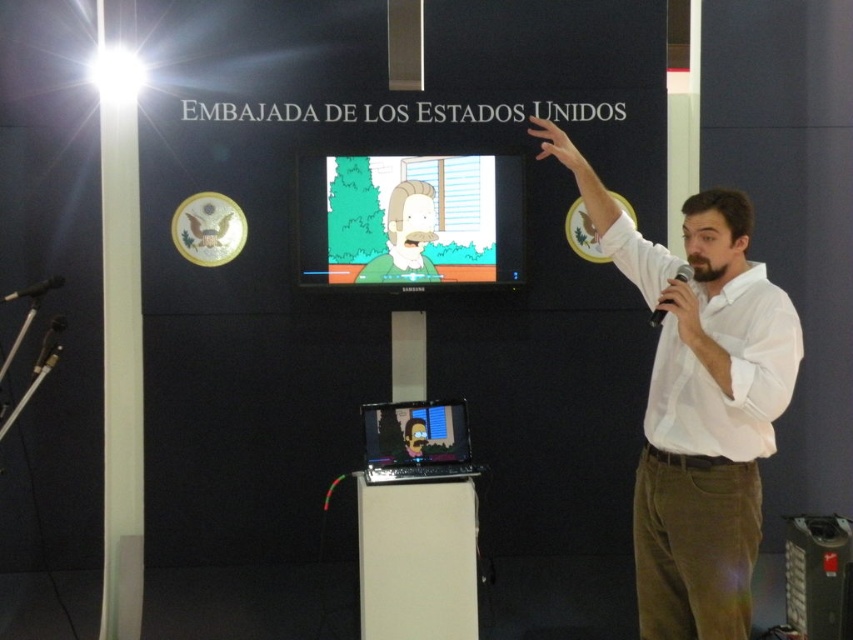
You are standing in front of the United States Embassy event backdrop. There are two points marked in the image. Which point, point 1 at coordinates (364, 420) or point 2 at coordinates (555, 156), is closer to you?

Point 1 at coordinates (364, 420) is closer to you than point 2 at coordinates (555, 156).

You are an event organizer who needs to locate the matte black laptop at right for a quick presentation adjustment. According to the coordinates given, where exactly should you look in the image?

The matte black laptop at right is located at point (816, 573) in the image.